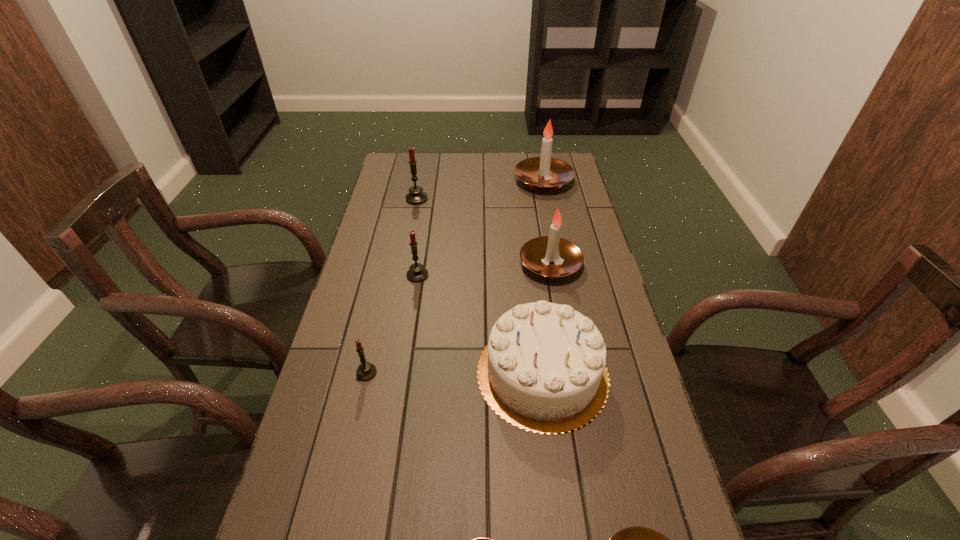
Identify the location of free region located on the front of the third smallest white candle. (571, 384).

What are the coordinates of `blank space located on the back of the birthday cake` in the screenshot? It's located at (528, 256).

I want to click on vacant space located 0.320m on the right of the second biggest red candle, so click(x=527, y=275).

You are a GUI agent. You are given a task and a screenshot of the screen. Output one action in this format:
    pyautogui.click(x=<x>, y=<y>)
    Task: Click on the free space located 0.090m on the front of the third nearest candle
    This screenshot has width=960, height=540.
    Given the screenshot: What is the action you would take?
    pyautogui.click(x=358, y=413)

Find the location of a particular element. Image resolution: width=960 pixels, height=540 pixels. object located in the far edge section of the desktop is located at coordinates (544, 173).

Locate an element on the screen. birthday cake present at the right edge is located at coordinates click(x=543, y=370).

This screenshot has height=540, width=960. Identify the location of object present at the far right corner. (544, 173).

In the image, there is a desktop. At what (x,y) coordinates should I click in order to perform the action: click on free space at the far edge. Please return your answer as a coordinate pair (x, y). The height and width of the screenshot is (540, 960). Looking at the image, I should click on (494, 170).

Find the location of a particular element. This screenshot has height=540, width=960. vacant space at the left edge of the desktop is located at coordinates (376, 250).

The image size is (960, 540). What are the coordinates of `vacant space at the right edge` in the screenshot? It's located at (601, 265).